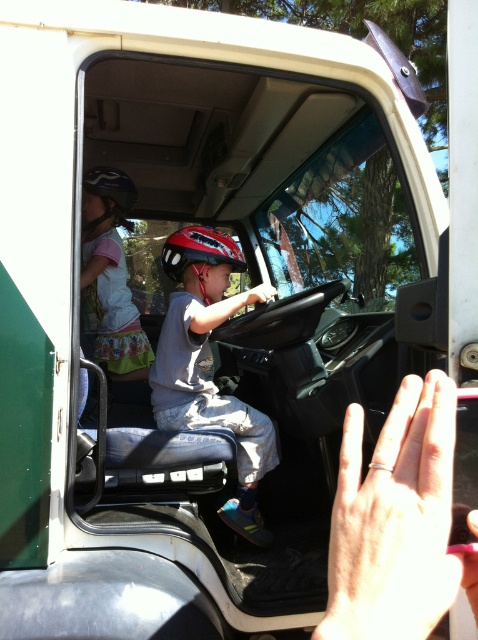
Question: Which point is farther from the camera taking this photo?

Choices:
 (A) (180, 257)
 (B) (100, 294)

Answer: (B)

Question: Which point is farther to the camera?

Choices:
 (A) matte red helmet at center
 (B) matte gray helmet at center

Answer: (A)

Question: Does matte gray helmet at center have a lesser width compared to matte red helmet at center?

Choices:
 (A) yes
 (B) no

Answer: (B)

Question: Which point appears farthest from the camera in this image?

Choices:
 (A) (207, 394)
 (B) (130, 337)
 (C) (182, 234)

Answer: (B)

Question: Does matte black helmet at upper left have a greater width compared to matte red helmet at center?

Choices:
 (A) yes
 (B) no

Answer: (B)

Question: Does matte gray helmet at center have a lesser width compared to matte black helmet at upper left?

Choices:
 (A) no
 (B) yes

Answer: (A)